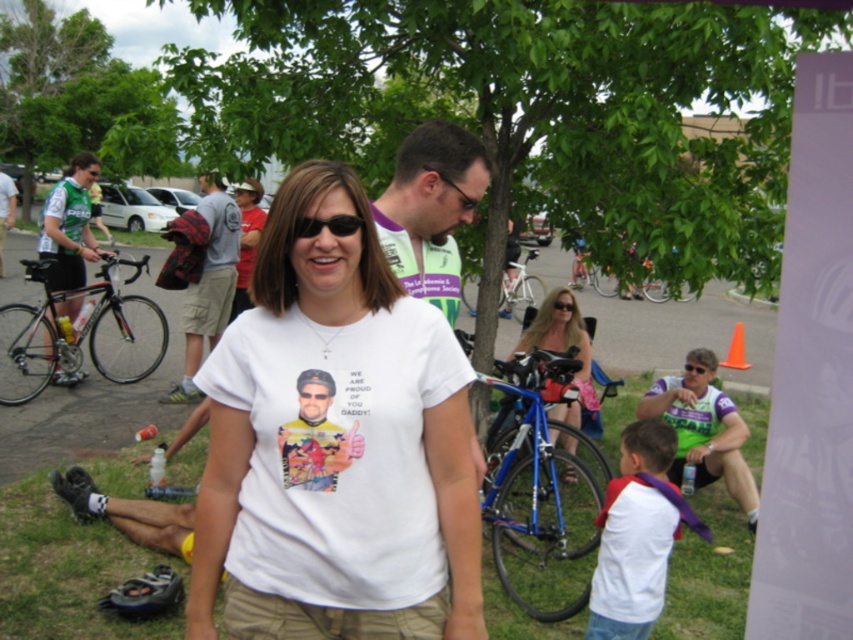
You are standing in the park and see two points in the scene. Which point is closer to you, point (434,340) or point (409,204)?

Point (434,340) is closer to the viewer than point (409,204).

You are a photographer at the event and want to capture both the shiny black frame bicycle at left and the silver metallic bicycle at center in a single shot. Which bicycle will appear narrower in the photo?

The shiny black frame bicycle at left will appear narrower in the photo because it is thinner than the silver metallic bicycle at center.